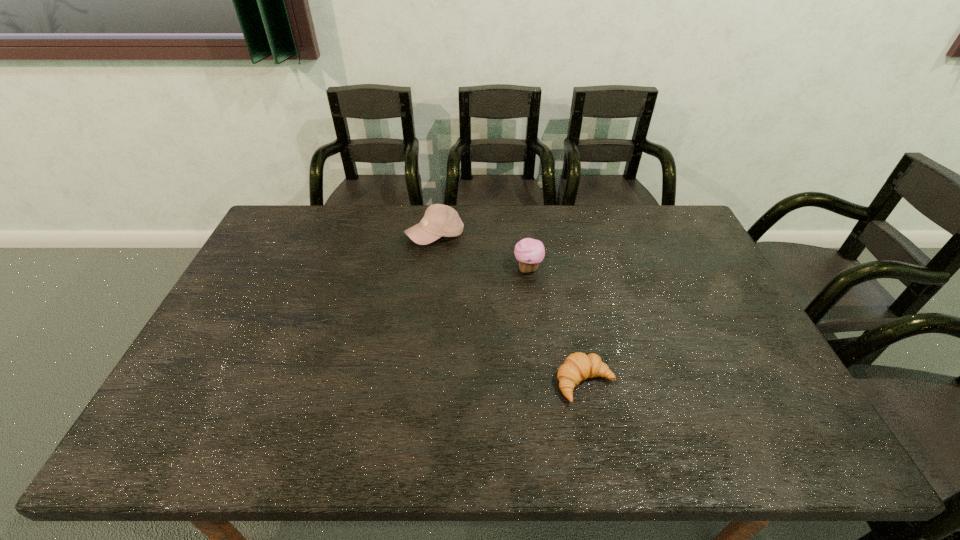
Locate an element on the screen. vacant region at the near edge is located at coordinates (614, 440).

Where is `vacant position at the right edge of the desktop`? The width and height of the screenshot is (960, 540). vacant position at the right edge of the desktop is located at coordinates (711, 305).

This screenshot has width=960, height=540. What are the coordinates of `vacant space at the far right corner` in the screenshot? It's located at (663, 217).

The width and height of the screenshot is (960, 540). Identify the location of vacant area between the second farthest object and the baseball cap. (482, 252).

Find the location of a particular element. empty location between the nearest object and the second farthest object is located at coordinates (557, 326).

Where is `empty space between the cupcake and the baseball cap`? empty space between the cupcake and the baseball cap is located at coordinates (482, 252).

Locate an element on the screen. vacant region between the baseball cap and the crescent roll is located at coordinates (511, 309).

Where is `free space between the nearest object and the baseball cap`? free space between the nearest object and the baseball cap is located at coordinates (511, 309).

The image size is (960, 540). I want to click on vacant area that lies between the nearest object and the farthest object, so click(511, 309).

You are a GUI agent. You are given a task and a screenshot of the screen. Output one action in this format:
    pyautogui.click(x=<x>, y=<y>)
    Task: Click on the unoccupied position between the crescent roll and the leftmost object
    
    Given the screenshot: What is the action you would take?
    pyautogui.click(x=511, y=309)